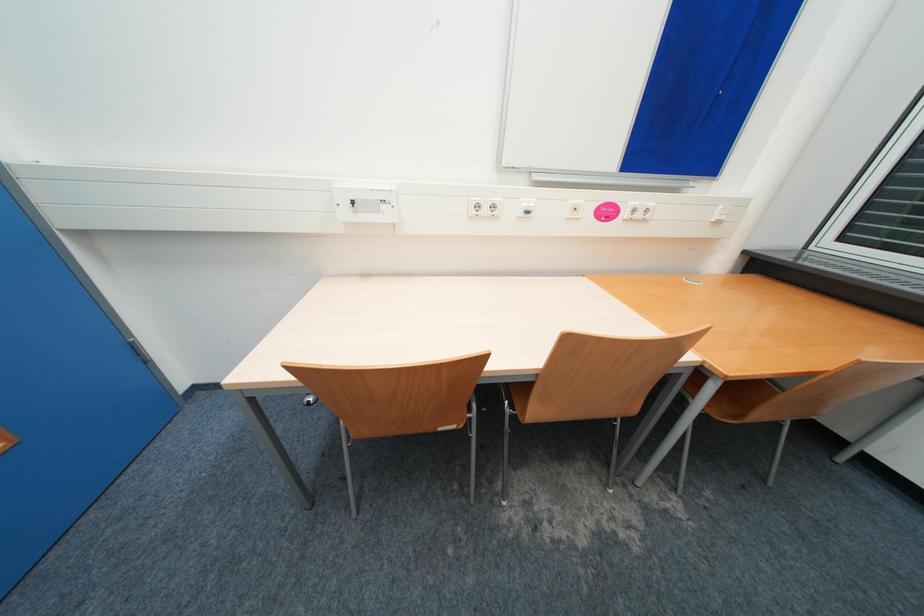
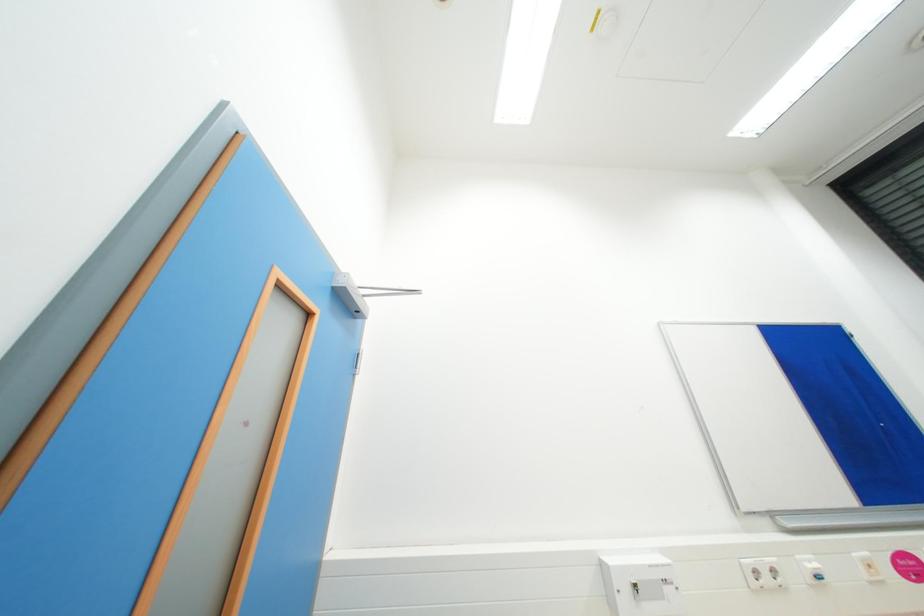
Question: How did the camera likely rotate?

Choices:
 (A) Left
 (B) Right
 (C) Up
 (D) Down

Answer: (C)